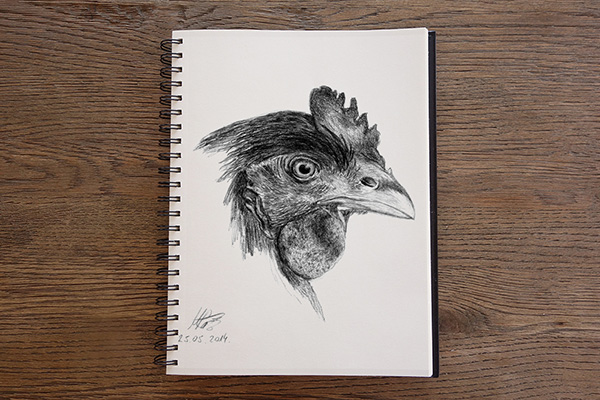
I want to click on dark wood table/desk, so click(x=542, y=281).